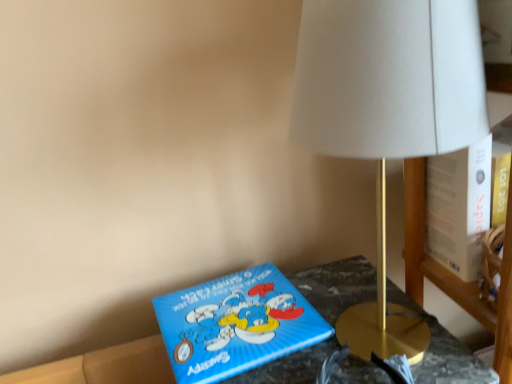
Question: Is blue cardboard box at lower left in front of or behind gold metallic lamp at upper right in the image?

Choices:
 (A) behind
 (B) front

Answer: (A)

Question: Is point [293, 375] positioned closer to the camera than point [346, 109]?

Choices:
 (A) closer
 (B) farther

Answer: (B)

Question: Considering the real-world distances, which object is closest to the blue cardboard box at lower left?

Choices:
 (A) blue matte puzzle box at lower center
 (B) gold metallic lamp at upper right

Answer: (A)

Question: Estimate the real-world distances between objects in this image. Which object is closer to the blue matte puzzle box at lower center?

Choices:
 (A) blue cardboard box at lower left
 (B) gold metallic lamp at upper right

Answer: (A)